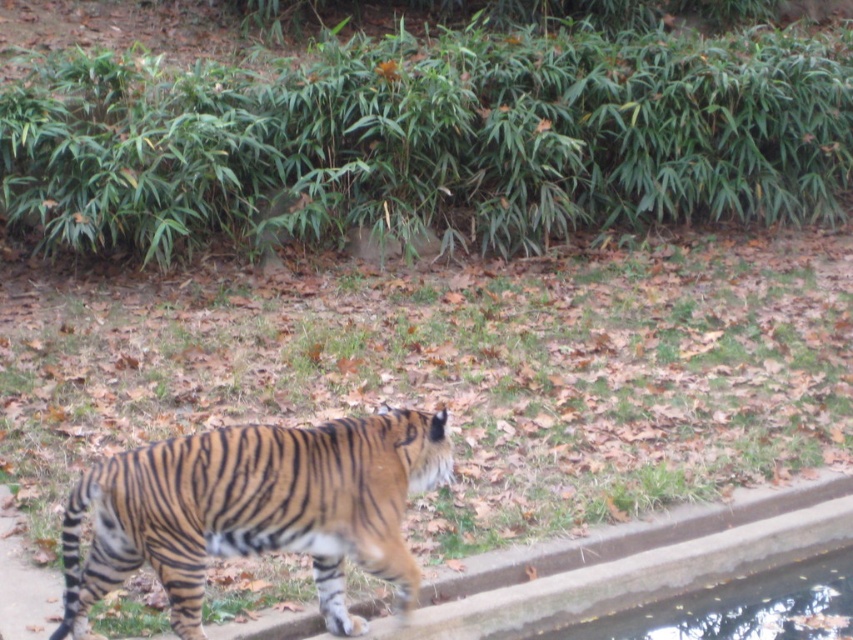
You are a zookeeper observing the tiger in its enclosure. You notice a point marked at coordinates (x=254, y=509). Where is the orange brown striped tiger at center in relation to this point?

The orange brown striped tiger at center is located exactly at the point marked at coordinates (x=254, y=509).